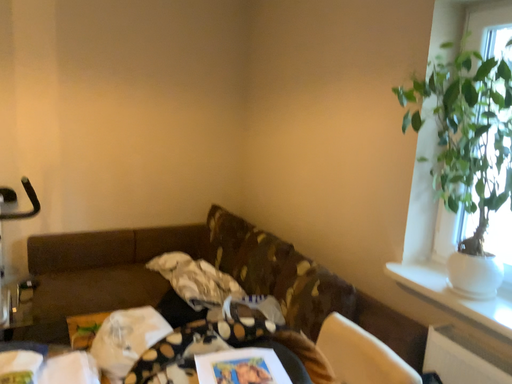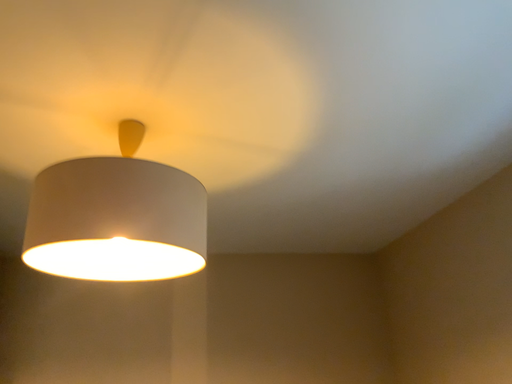
Question: Which way did the camera rotate in the video?

Choices:
 (A) rotated left
 (B) rotated right

Answer: (A)